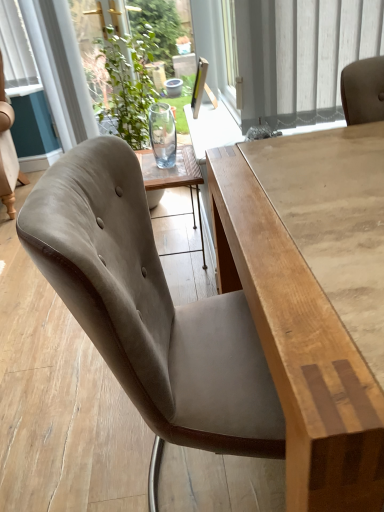
Question: Could you tell me if suede-like beige chair at center is facing light brown wood table at center?

Choices:
 (A) no
 (B) yes

Answer: (A)

Question: From a real-world perspective, is suede-like beige chair at center located higher than light brown wood table at center?

Choices:
 (A) no
 (B) yes

Answer: (A)

Question: Is suede-like beige chair at center beside light brown wood table at center?

Choices:
 (A) yes
 (B) no

Answer: (B)

Question: Is suede-like beige chair at center turned away from light brown wood table at center?

Choices:
 (A) no
 (B) yes

Answer: (A)

Question: Can you confirm if suede-like beige chair at center is taller than light brown wood table at center?

Choices:
 (A) no
 (B) yes

Answer: (A)

Question: From their relative heights in the image, would you say transparent glass vase at upper center is taller or shorter than suede-like beige chair at center?

Choices:
 (A) short
 (B) tall

Answer: (B)

Question: In the image, is transparent glass vase at upper center on the left side or the right side of suede-like beige chair at center?

Choices:
 (A) left
 (B) right

Answer: (B)

Question: Looking at their shapes, would you say transparent glass vase at upper center is wider or thinner than suede-like beige chair at center?

Choices:
 (A) thin
 (B) wide

Answer: (A)

Question: Would you say transparent glass vase at upper center is inside or outside suede-like beige chair at center?

Choices:
 (A) inside
 (B) outside

Answer: (B)

Question: In terms of height, does light brown wood table at center look taller or shorter compared to transparent glass vase at upper center?

Choices:
 (A) short
 (B) tall

Answer: (A)

Question: From a real-world perspective, is light brown wood table at center positioned above or below transparent glass vase at upper center?

Choices:
 (A) below
 (B) above

Answer: (A)

Question: Considering the relative positions of light brown wood table at center and transparent glass vase at upper center in the image provided, is light brown wood table at center to the left or to the right of transparent glass vase at upper center?

Choices:
 (A) right
 (B) left

Answer: (A)

Question: Looking at the image, does light brown wood table at center seem bigger or smaller compared to transparent glass vase at upper center?

Choices:
 (A) big
 (B) small

Answer: (A)

Question: From the image's perspective, relative to light brown wood table at center, is suede-like beige chair at center above or below?

Choices:
 (A) below
 (B) above

Answer: (B)

Question: From a real-world perspective, is suede-like beige chair at center above or below light brown wood table at center?

Choices:
 (A) above
 (B) below

Answer: (B)